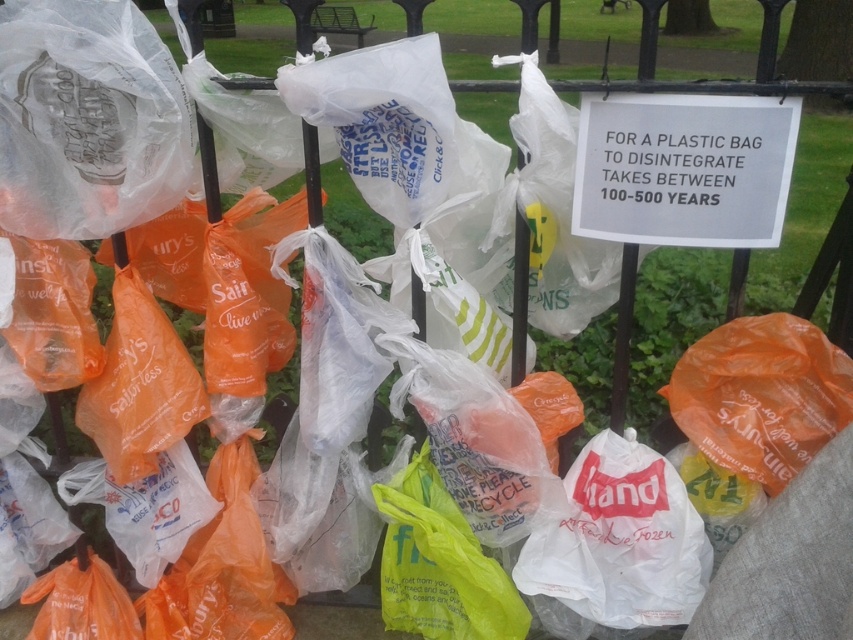
Does white paper sign at upper center have a larger size compared to translucent yellow plastic bag at center?

Actually, white paper sign at upper center might be smaller than translucent yellow plastic bag at center.

The width and height of the screenshot is (853, 640). Find the location of `white paper sign at upper center`. white paper sign at upper center is located at coordinates (683, 168).

Which is in front, point (776, 109) or point (392, 557)?

Point (776, 109) is in front.

The width and height of the screenshot is (853, 640). I want to click on white paper sign at upper center, so click(x=683, y=168).